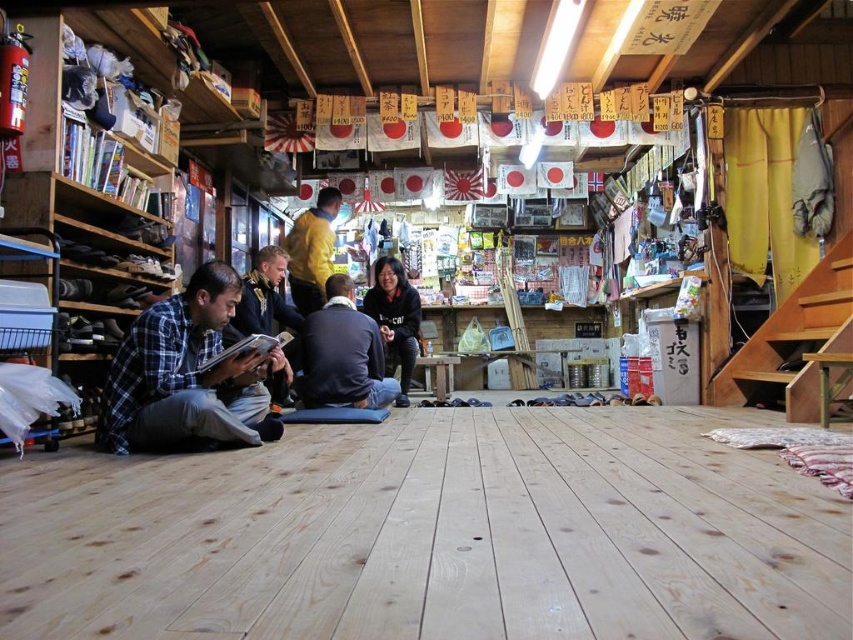
Looking at this image, you are a customer trying to decide between two jackets displayed in the center of the shop. The golden leather jacket at center and the black matte jacket at center are both on display. Which jacket is wider?

The golden leather jacket at center is wider than the black matte jacket at center according to the description.

You are a customer in this shop and want to buy a shirt and a sweater. You notice the plaid fabric shirt at lower left and the dark gray sweater at center. Which item is bigger in size?

The plaid fabric shirt at lower left is larger in size compared to the dark gray sweater at center.